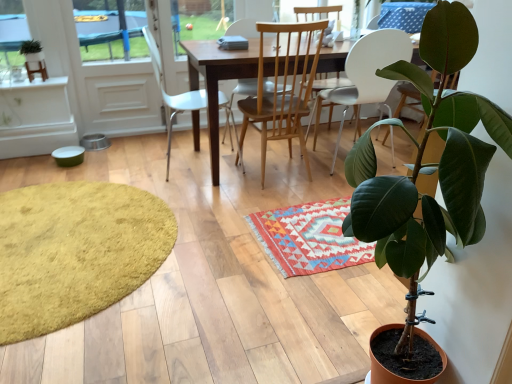
This screenshot has height=384, width=512. I want to click on free space between white plastic chair at center, placed as the first chair when sorted from left to right, and light wood/wooden chair at center, acting as the 2th chair starting from the left, so click(x=229, y=166).